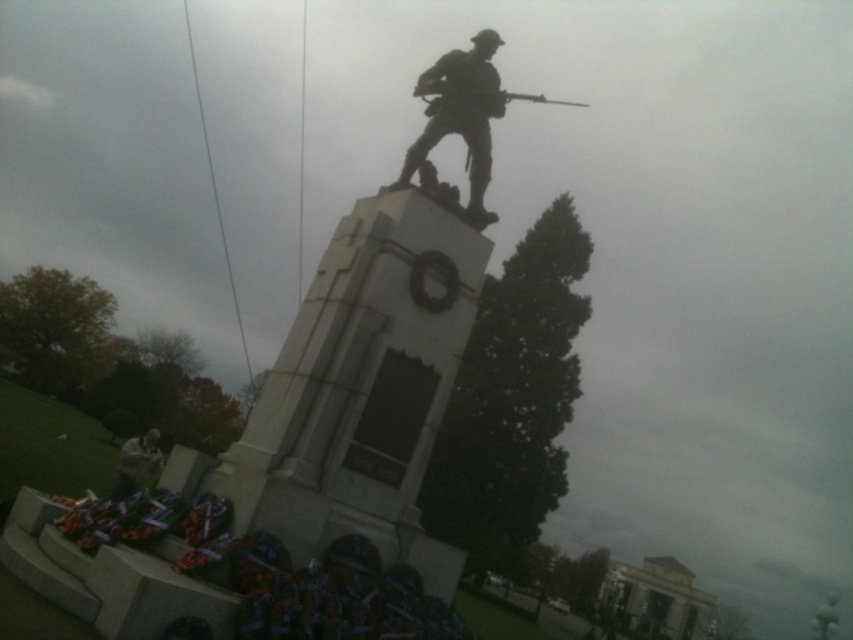
You are a photographer trying to capture the polished bronze soldier at center and the metallic silver helmet at lower left in a single frame. Based on their sizes, which object should you focus on first to ensure both are clearly visible in the photo?

The polished bronze soldier at center is smaller than the metallic silver helmet at lower left, so you should focus on the metallic silver helmet at lower left first to ensure both are clearly visible in the photo.

You are a photographer standing at the base of the war memorial. You want to capture a photo of the polished bronze soldier at center so that it fills the frame without any distortion. Based on the scene description, what is the minimum distance you need to maintain from the soldier to achieve this?

The polished bronze soldier at center is 28.06 feet from camera. To capture it without distortion, you should maintain a distance of at least 28.06 feet from the soldier.

You are standing in front of the war memorial and notice the polished bronze soldier at center and the shiny metallic rifle at upper center. Which object is positioned to the left of the other?

The polished bronze soldier at center is positioned to the left of the shiny metallic rifle at upper center.